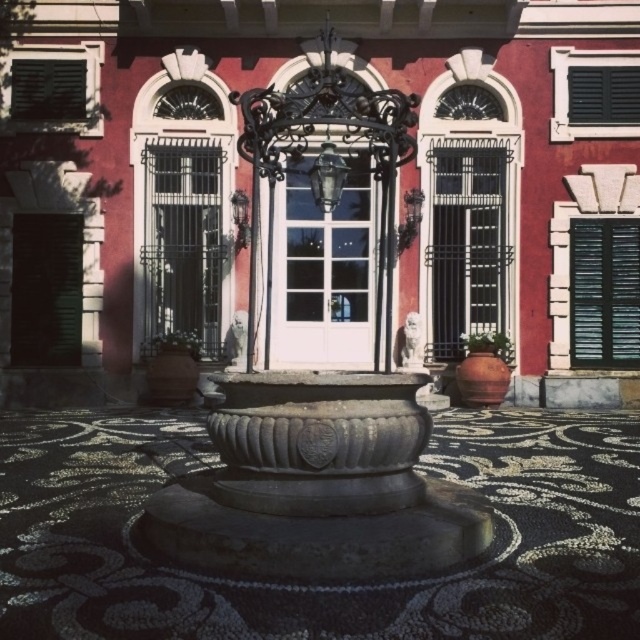
Looking at this image, you are a delivery person standing at the entrance of the building. You need to deliver a package to the office located behind the black matte shutter at upper right. The delivery robot you are using has a maximum reach of 7 feet. Can the robot reach the office from the black metal gate at center without moving closer?

The black metal gate at center is 7.82 feet away from the black matte shutter at upper right. Since the robot can only reach up to 7 feet, it cannot reach the office from the black metal gate at center without moving closer.